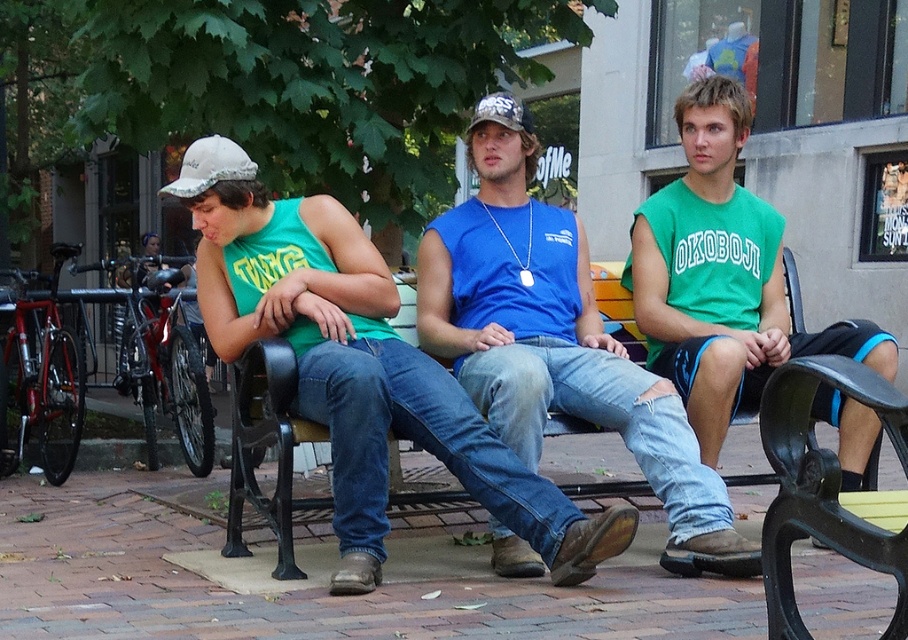
Question: Is green cotton shirt at center smaller than yellow painted wood bench at center?

Choices:
 (A) yes
 (B) no

Answer: (B)

Question: Which object is closer to the camera taking this photo?

Choices:
 (A) yellow painted wood bench at center
 (B) blue denim jeans at center
 (C) green cotton shirt at center

Answer: (B)

Question: Can you confirm if blue denim jeans at center is smaller than white fabric baseball cap at left?

Choices:
 (A) no
 (B) yes

Answer: (A)

Question: Which object appears closest to the camera in this image?

Choices:
 (A) blue denim jeans at center
 (B) white fabric baseball cap at left
 (C) matte green tank top at left
 (D) yellow painted wood bench at center

Answer: (C)

Question: Can you confirm if green cotton shirt at center is bigger than yellow painted wood bench at center?

Choices:
 (A) yes
 (B) no

Answer: (A)

Question: Estimate the real-world distances between objects in this image. Which object is farther from the white fabric baseball cap at left?

Choices:
 (A) matte green tank top at left
 (B) yellow painted wood bench at center

Answer: (B)